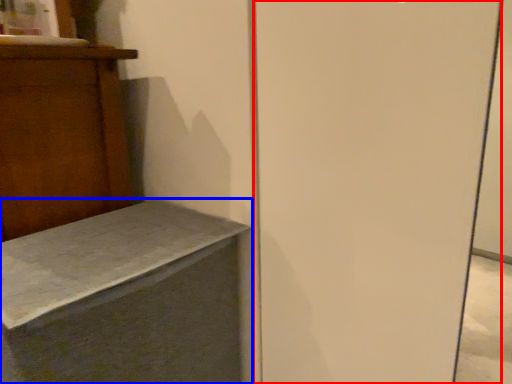
Question: Among these objects, which one is farthest to the camera, screen door (highlighted by a red box) or furniture (highlighted by a blue box)?

Choices:
 (A) screen door
 (B) furniture

Answer: (B)